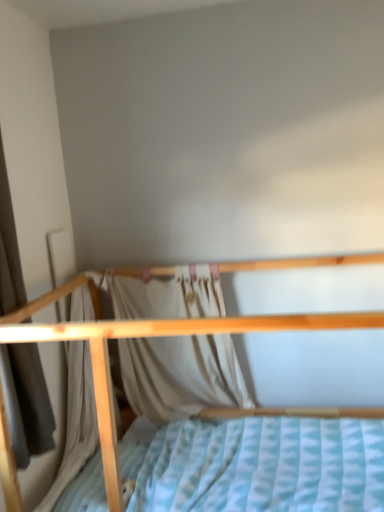
Question: From the image's perspective, is white fabric curtain at center, which ranks as the first curtain in back-to-front order, below wooden bed at center?

Choices:
 (A) yes
 (B) no

Answer: (B)

Question: Is white fabric curtain at center, which ranks as the first curtain in back-to-front order, wider than wooden bed at center?

Choices:
 (A) no
 (B) yes

Answer: (A)

Question: From the image's perspective, is white fabric curtain at center, which is the 1th curtain in right-to-left order, on wooden bed at center?

Choices:
 (A) no
 (B) yes

Answer: (B)

Question: From a real-world perspective, does white fabric curtain at center, which is the 1th curtain in right-to-left order, stand above wooden bed at center?

Choices:
 (A) no
 (B) yes

Answer: (B)

Question: Does white fabric curtain at center, marked as the second curtain in a left-to-right arrangement, have a smaller size compared to wooden bed at center?

Choices:
 (A) no
 (B) yes

Answer: (B)

Question: Does white fabric curtain at center, marked as the second curtain in a left-to-right arrangement, turn towards wooden bed at center?

Choices:
 (A) no
 (B) yes

Answer: (B)

Question: Is wooden bed at center oriented towards white fabric curtain at center, marked as the second curtain in a left-to-right arrangement?

Choices:
 (A) yes
 (B) no

Answer: (A)

Question: Is white fabric curtain at center, marked as the second curtain in a left-to-right arrangement, a part of wooden bed at center?

Choices:
 (A) no
 (B) yes

Answer: (B)

Question: From a real-world perspective, does wooden bed at center stand above white fabric curtain at center, which ranks as the first curtain in back-to-front order?

Choices:
 (A) yes
 (B) no

Answer: (B)

Question: Does wooden bed at center have a greater height compared to white fabric curtain at center, marked as the second curtain in a left-to-right arrangement?

Choices:
 (A) no
 (B) yes

Answer: (B)

Question: Can you confirm if wooden bed at center is bigger than white fabric curtain at center, marked as the second curtain in a left-to-right arrangement?

Choices:
 (A) yes
 (B) no

Answer: (A)

Question: Is wooden bed at center in contact with white fabric curtain at center, which ranks as the first curtain in back-to-front order?

Choices:
 (A) yes
 (B) no

Answer: (B)

Question: Is white fabric curtain at center, which is the 1th curtain in right-to-left order, looking in the opposite direction of light beige fabric curtain at left, which ranks as the first curtain in left-to-right order?

Choices:
 (A) no
 (B) yes

Answer: (A)